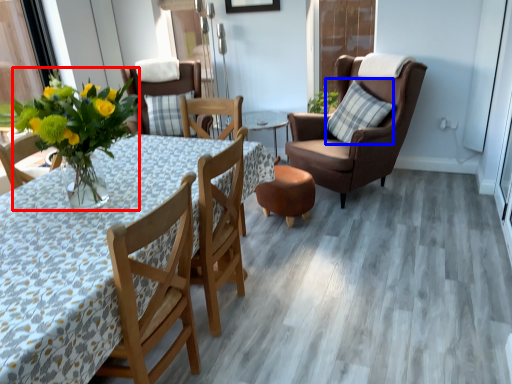
Question: Among these objects, which one is nearest to the camera, floral arrangement (highlighted by a red box) or pillow (highlighted by a blue box)?

Choices:
 (A) floral arrangement
 (B) pillow

Answer: (A)